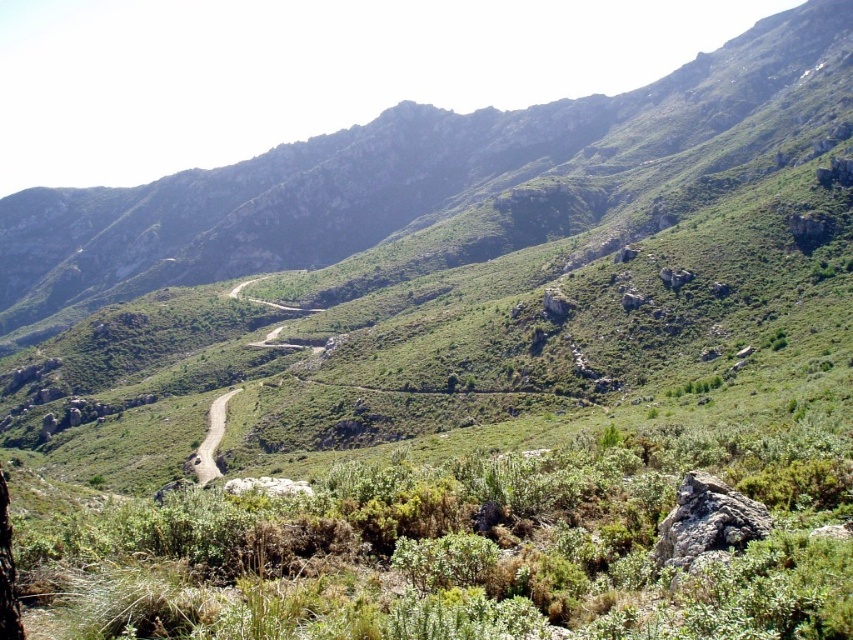
Question: Which object is farther from the camera taking this photo?

Choices:
 (A) dirt/path at center
 (B) green shrubbery at center

Answer: (A)

Question: Is green shrubbery at center further to the viewer compared to dirt/path at center?

Choices:
 (A) yes
 (B) no

Answer: (B)

Question: Among these points, which one is farthest from the camera?

Choices:
 (A) (219, 435)
 (B) (144, 509)

Answer: (A)

Question: Which of the following is the farthest from the observer?

Choices:
 (A) (196, 468)
 (B) (112, 595)

Answer: (A)

Question: Can you confirm if green shrubbery at center is wider than dirt/path at center?

Choices:
 (A) no
 (B) yes

Answer: (A)

Question: Can you confirm if green shrubbery at center is bigger than dirt/path at center?

Choices:
 (A) yes
 (B) no

Answer: (B)